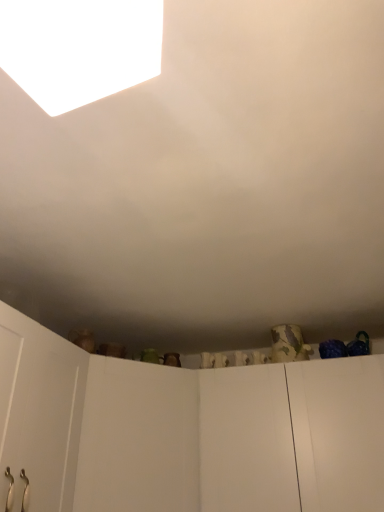
Question: Considering their positions, is white matte light at upper left located in front of or behind white matte door at center?

Choices:
 (A) front
 (B) behind

Answer: (A)

Question: From a real-world perspective, is white matte light at upper left positioned above or below white matte door at center?

Choices:
 (A) below
 (B) above

Answer: (B)

Question: From the image's perspective, is white matte light at upper left located above or below white matte door at center?

Choices:
 (A) below
 (B) above

Answer: (B)

Question: Does point (165, 471) appear closer or farther from the camera than point (115, 12)?

Choices:
 (A) closer
 (B) farther

Answer: (B)

Question: From the image's perspective, is white matte door at center above or below white matte light at upper left?

Choices:
 (A) above
 (B) below

Answer: (B)

Question: From their relative heights in the image, would you say white matte door at center is taller or shorter than white matte light at upper left?

Choices:
 (A) tall
 (B) short

Answer: (A)

Question: From a real-world perspective, is white matte door at center positioned above or below white matte light at upper left?

Choices:
 (A) below
 (B) above

Answer: (A)